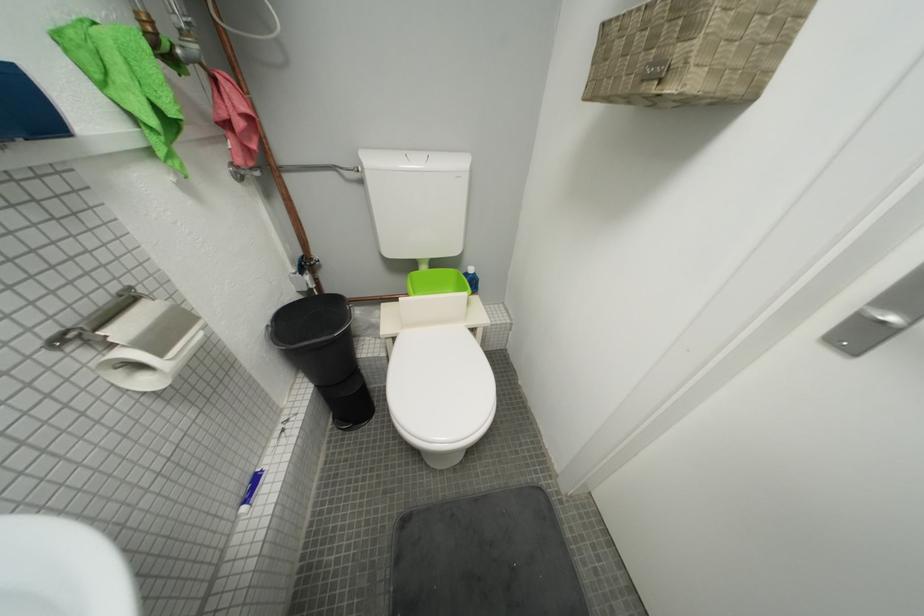
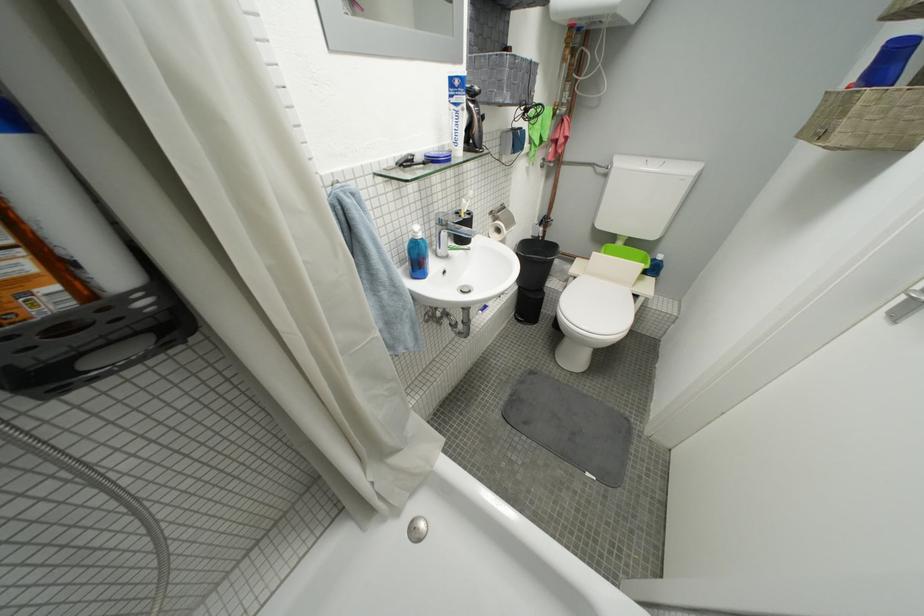
Locate, in the second image, the point that corresponds to (345,434) in the first image.

(523, 322)